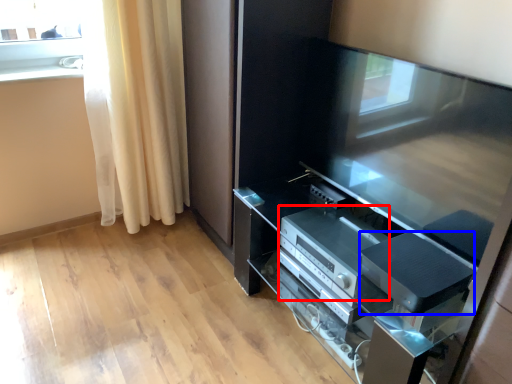
Question: Among these objects, which one is nearest to the camera, appliance (highlighted by a red box) or appliance (highlighted by a blue box)?

Choices:
 (A) appliance
 (B) appliance

Answer: (B)